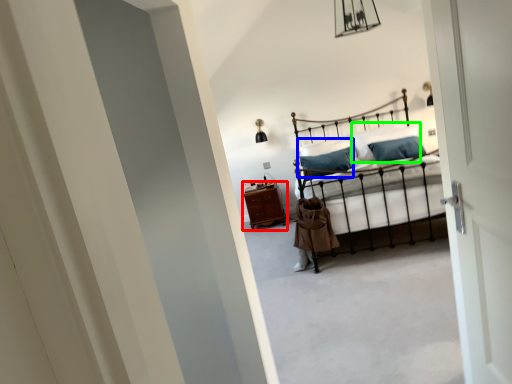
Question: Considering the real-world distances, which object is closest to nightstand (highlighted by a red box)? pillow (highlighted by a blue box) or pillow (highlighted by a green box).

Choices:
 (A) pillow
 (B) pillow

Answer: (A)